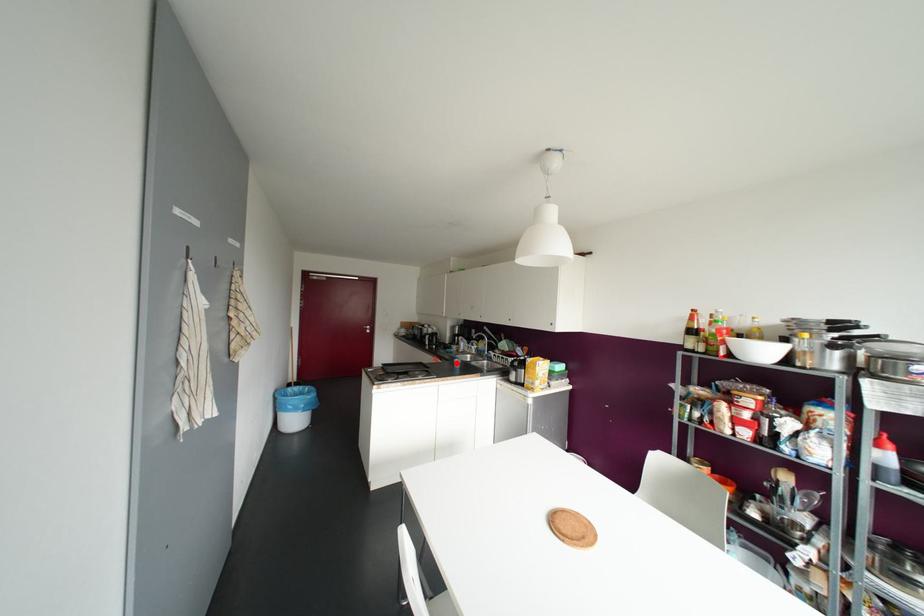
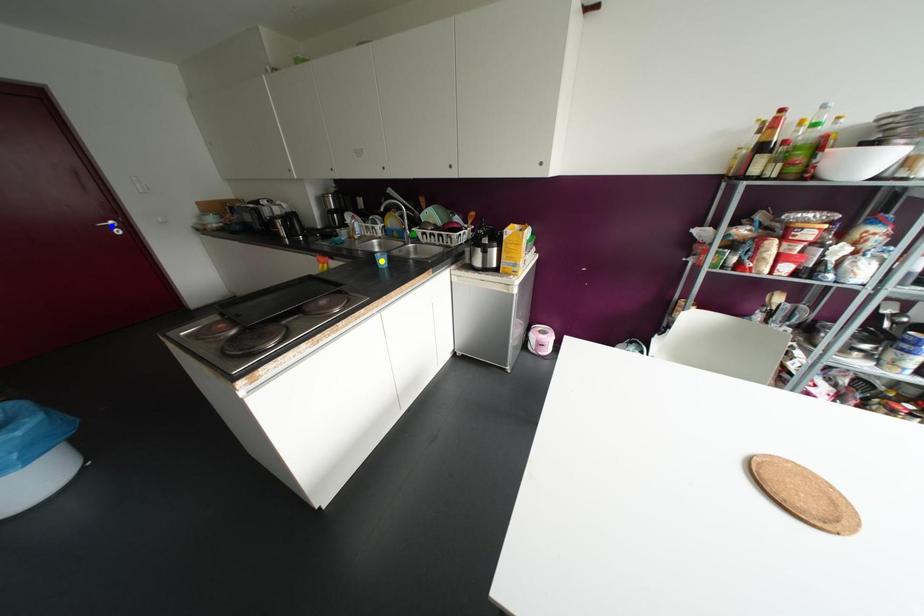
Question: I am providing you with two images of the same scene from different viewpoints. A red point is marked on the first image. You are given multiple points on the second image. Which mark in image 2 goes with the point in image 1?

Choices:
 (A) blue point
 (B) green point
 (C) yellow point

Answer: (C)